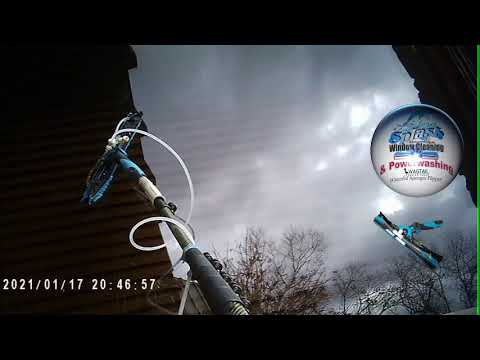
Where is `window frame`? This screenshot has height=360, width=480. window frame is located at coordinates (439, 80).